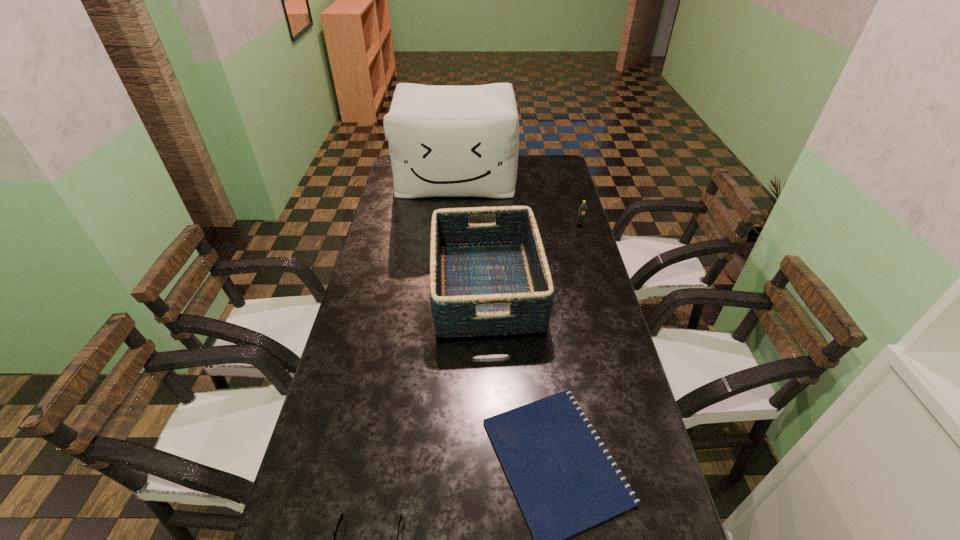
Where is `free spot that satisfies the following two spatial constraints: 1. on the side of the tallest object with the smiley face; 2. on the right side of the third nearest object`? The height and width of the screenshot is (540, 960). free spot that satisfies the following two spatial constraints: 1. on the side of the tallest object with the smiley face; 2. on the right side of the third nearest object is located at coordinates (447, 287).

You are a GUI agent. You are given a task and a screenshot of the screen. Output one action in this format:
    pyautogui.click(x=<x>, y=<y>)
    Task: Click on the free spot that satisfies the following two spatial constraints: 1. on the side of the tallest object with the smiley face; 2. on the left side of the second tallest object
    
    Given the screenshot: What is the action you would take?
    pyautogui.click(x=447, y=287)